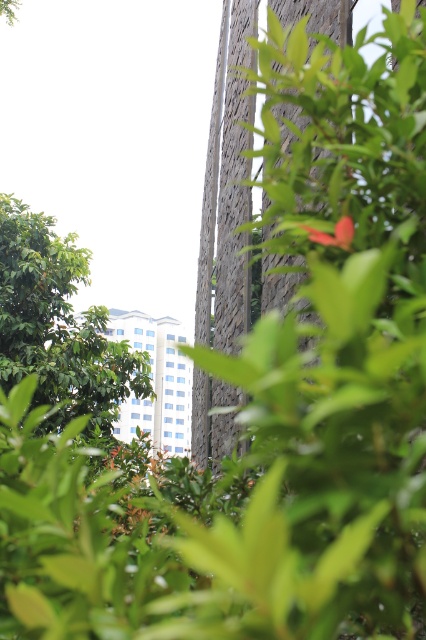
Question: Which object appears closest to the camera in this image?

Choices:
 (A) matte red flower at center
 (B) green leafy tree at lower left

Answer: (A)

Question: Which of the following is the closest to the observer?

Choices:
 (A) green leafy tree at lower left
 (B) matte red flower at center

Answer: (B)

Question: Does green leafy tree at lower left have a lesser width compared to matte red flower at center?

Choices:
 (A) yes
 (B) no

Answer: (B)

Question: Which object is farther from the camera taking this photo?

Choices:
 (A) green leafy tree at lower left
 (B) matte red flower at center

Answer: (A)

Question: Observing the image, what is the correct spatial positioning of green leafy tree at lower left in reference to matte red flower at center?

Choices:
 (A) left
 (B) right

Answer: (A)

Question: Is green leafy tree at lower left bigger than matte red flower at center?

Choices:
 (A) yes
 (B) no

Answer: (A)